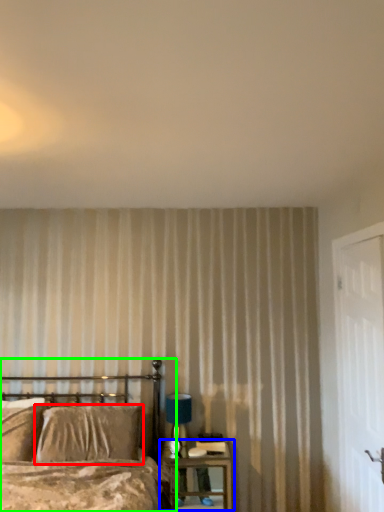
Question: Which object is positioned farthest from pillow (highlighted by a red box)? Select from nightstand (highlighted by a blue box) and bed (highlighted by a green box).

Choices:
 (A) nightstand
 (B) bed

Answer: (A)